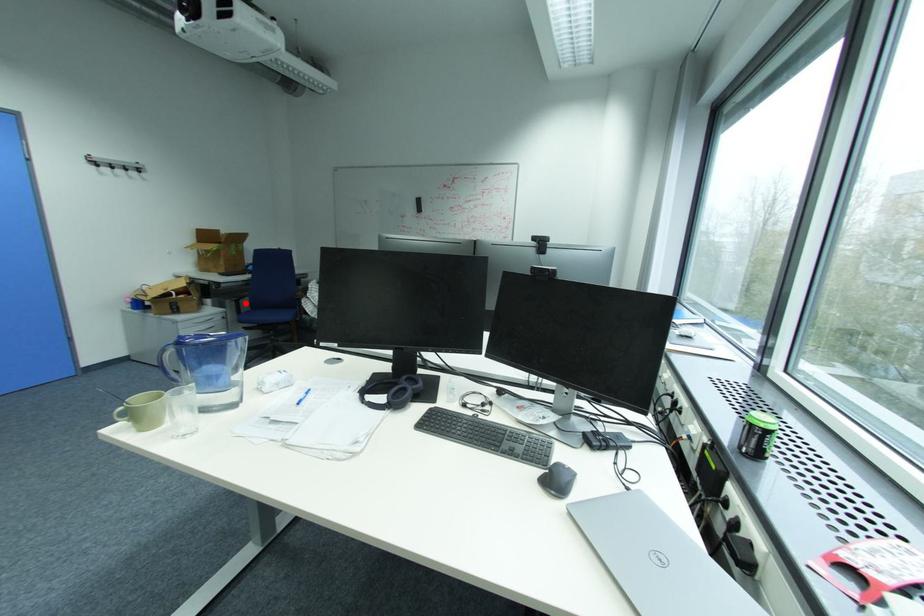
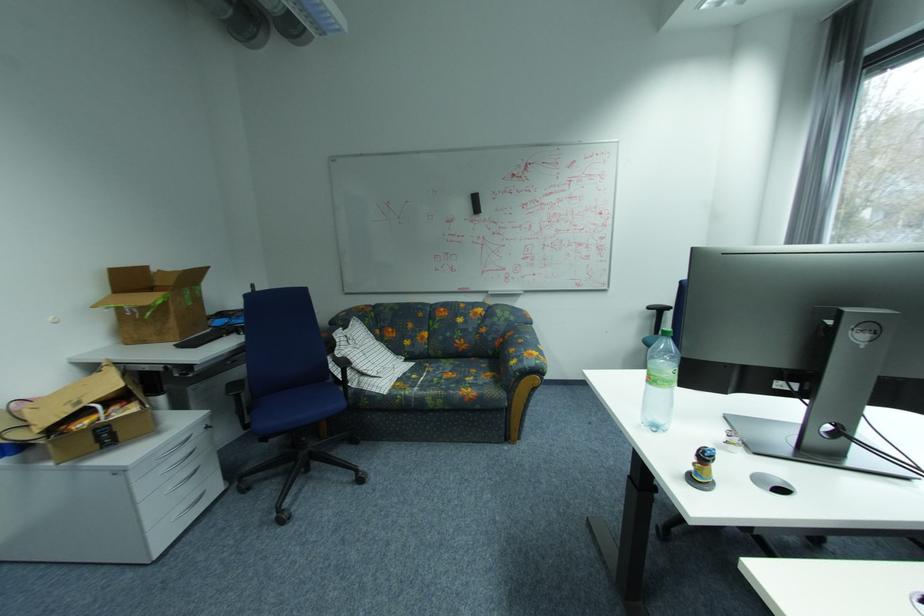
In the second image, find the point that corresponds to the highlighted location in the first image.

(247, 395)